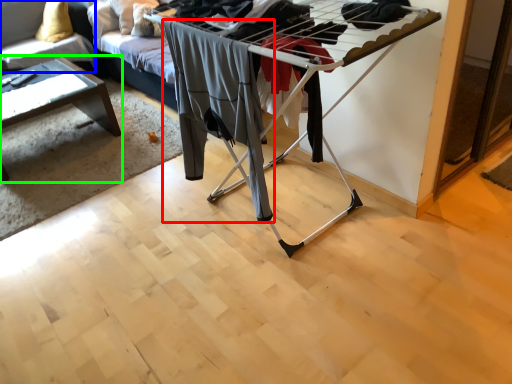
Question: Considering the real-world distances, which object is farthest from clothing (highlighted by a red box)? couch (highlighted by a blue box) or table (highlighted by a green box)?

Choices:
 (A) couch
 (B) table

Answer: (A)